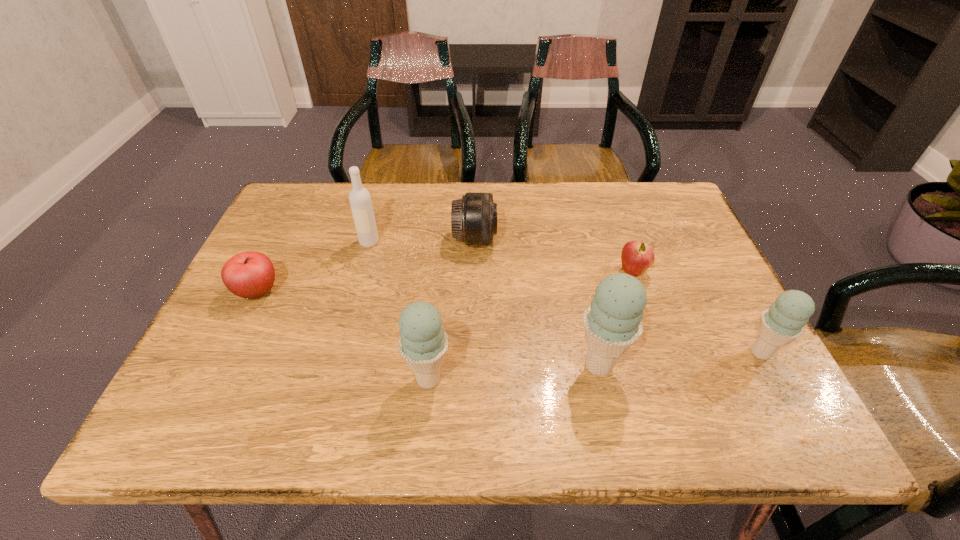
This screenshot has width=960, height=540. I want to click on free space that satisfies the following two spatial constraints: 1. on the front side of the fifth object from left to right; 2. on the right side of the leftmost object, so click(x=222, y=365).